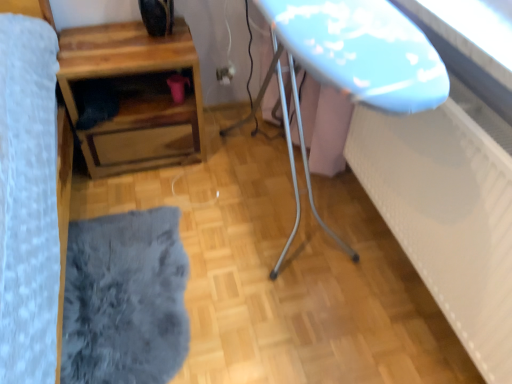
Question: From the image's perspective, relative to matte plastic outlet at center, is wooden table at lower left above or below?

Choices:
 (A) above
 (B) below

Answer: (B)

Question: In terms of height, does wooden table at lower left look taller or shorter compared to matte plastic outlet at center?

Choices:
 (A) short
 (B) tall

Answer: (B)

Question: Which object is positioned closest to the fuzzy gray rug at lower left?

Choices:
 (A) wooden table at lower left
 (B) matte plastic outlet at center

Answer: (A)

Question: Which object is the closest to the matte plastic outlet at center?

Choices:
 (A) fuzzy gray rug at lower left
 (B) wooden table at lower left

Answer: (B)